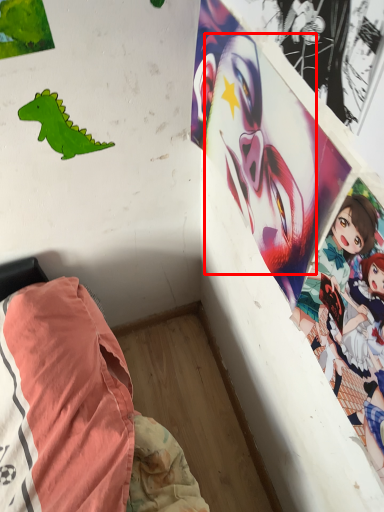
Question: Where is human face (annotated by the red box) located in relation to dinosaur in the image?

Choices:
 (A) right
 (B) left

Answer: (A)